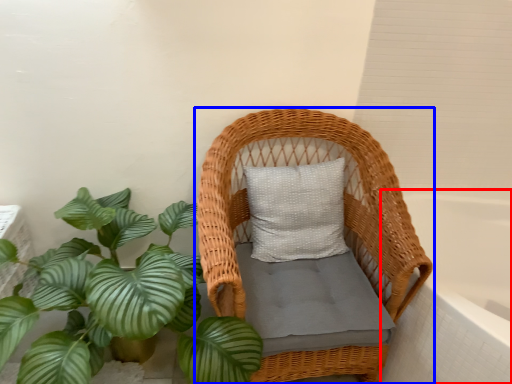
Question: Which of the following is the closest to the observer, bath (highlighted by a red box) or furniture (highlighted by a blue box)?

Choices:
 (A) bath
 (B) furniture

Answer: (B)